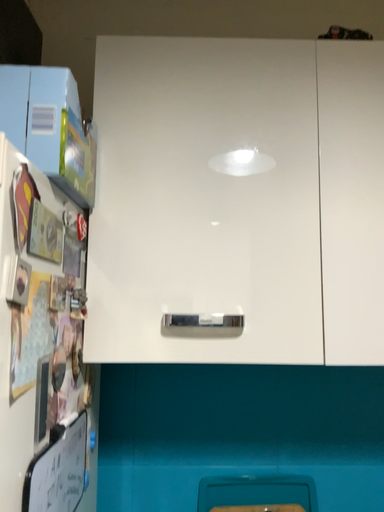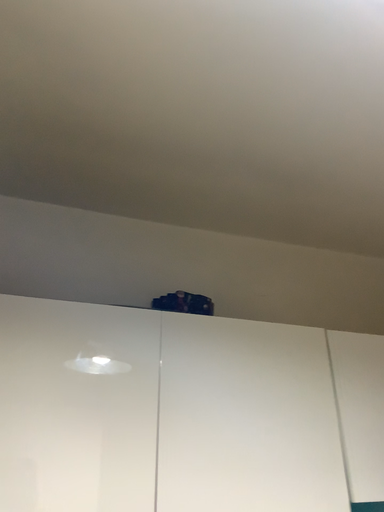
Question: How did the camera likely rotate when shooting the video?

Choices:
 (A) rotated right
 (B) rotated left

Answer: (A)